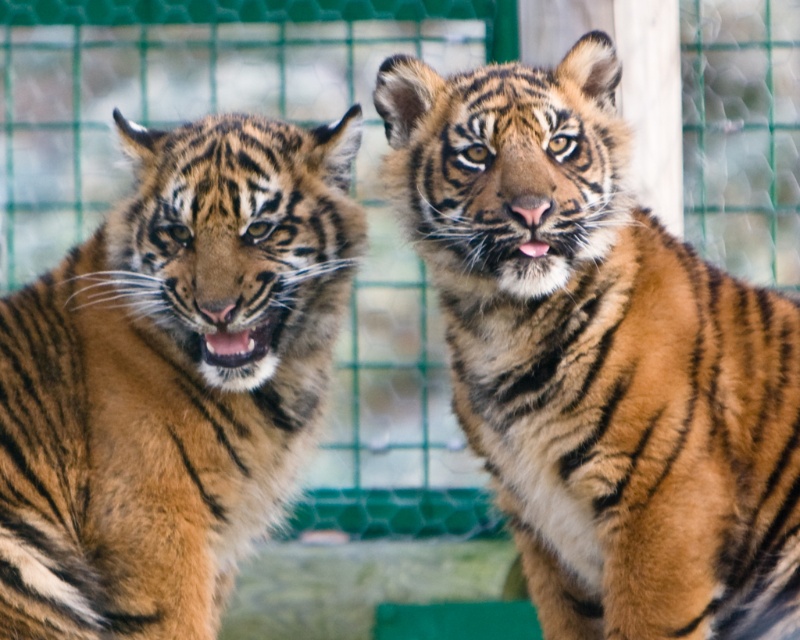
Can you confirm if orange-brown fur tiger at center is shorter than orange-brown fur tiger at left?

Incorrect, orange-brown fur tiger at center's height does not fall short of orange-brown fur tiger at left's.

Can you confirm if orange-brown fur tiger at center is thinner than orange-brown fur tiger at left?

In fact, orange-brown fur tiger at center might be wider than orange-brown fur tiger at left.

Does point (524, 324) lie behind point (8, 525)?

No, it is not.

This screenshot has width=800, height=640. I want to click on orange-brown fur tiger at center, so click(x=600, y=356).